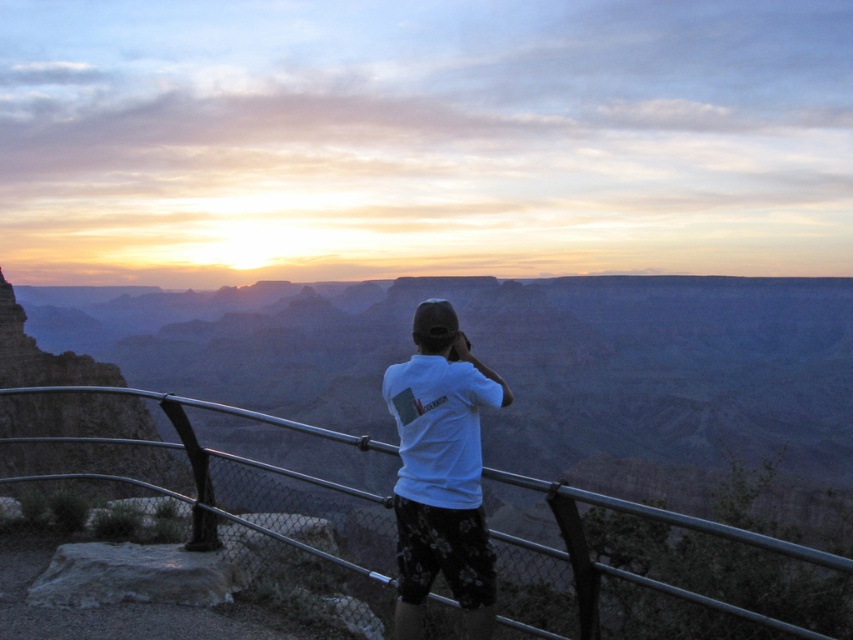
Who is more forward, (469, 483) or (688, 596)?

Point (688, 596) is in front.

Between white cotton shirt at center and metallic gray rail at center, which one is positioned higher?

white cotton shirt at center is above.

Is point (424, 579) more distant than point (527, 545)?

Yes, it is.

You are a GUI agent. You are given a task and a screenshot of the screen. Output one action in this format:
    pyautogui.click(x=<x>, y=<y>)
    Task: Click on the white cotton shirt at center
    The width and height of the screenshot is (853, 640).
    Given the screenshot: What is the action you would take?
    pyautogui.click(x=440, y=472)